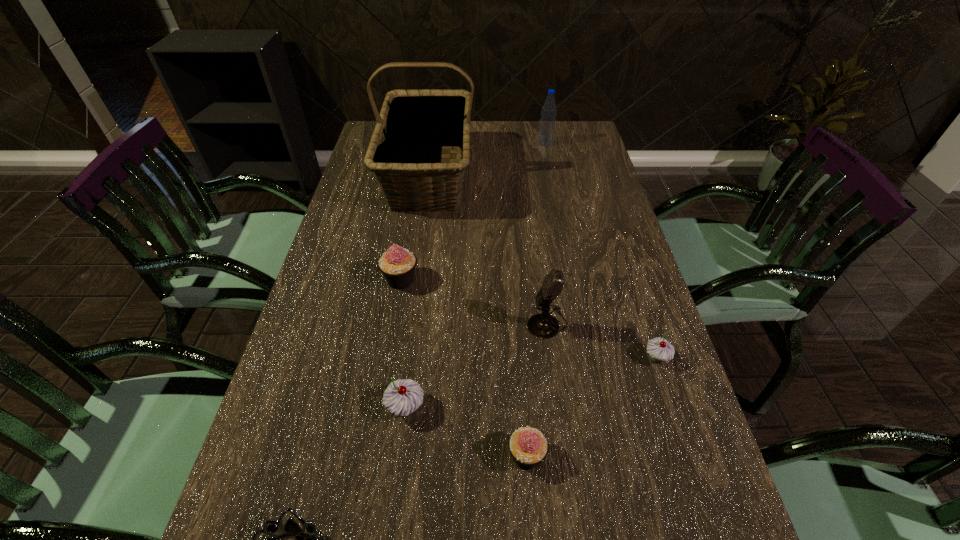
What are the coordinates of `vacant space located on the back of the seventh farthest object` in the screenshot? It's located at (521, 386).

The width and height of the screenshot is (960, 540). I want to click on basket that is at the far edge, so click(416, 119).

You are a GUI agent. You are given a task and a screenshot of the screen. Output one action in this format:
    pyautogui.click(x=<x>, y=<y>)
    Task: Click on the water bottle present at the far edge
    The height and width of the screenshot is (540, 960).
    Given the screenshot: What is the action you would take?
    pyautogui.click(x=547, y=123)

Locate an element on the screen. object at the left edge is located at coordinates (416, 119).

Locate an element on the screen. The image size is (960, 540). water bottle located at the right edge is located at coordinates (547, 123).

The width and height of the screenshot is (960, 540). I want to click on cupcake positioned at the right edge, so [x=659, y=349].

Locate an element on the screen. This screenshot has width=960, height=540. object that is positioned at the far left corner is located at coordinates (416, 119).

Where is `object at the far right corner`? This screenshot has width=960, height=540. object at the far right corner is located at coordinates (547, 123).

Identify the location of free space at the far edge. (532, 153).

Identify the location of free space at the left edge of the desktop. (348, 428).